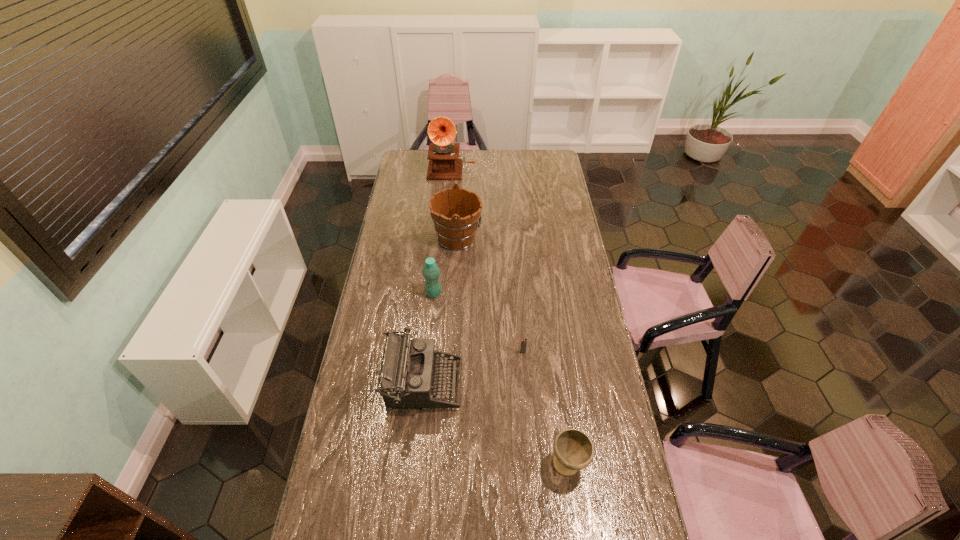
Where is `free region located 0.080m on the horn of the phonograph record`? This screenshot has height=540, width=960. free region located 0.080m on the horn of the phonograph record is located at coordinates (450, 188).

Locate an element on the screen. The image size is (960, 540). vacant space situated with the handle on the wine bucket is located at coordinates (503, 239).

This screenshot has width=960, height=540. I want to click on free spot located at the front cap of the water bottle, so click(466, 293).

Locate an element on the screen. The width and height of the screenshot is (960, 540). vacant region located on the typing side of the typewriter is located at coordinates (551, 384).

Locate an element on the screen. The width and height of the screenshot is (960, 540). vacant space located 0.150m on the back of the second shortest object is located at coordinates (560, 403).

Locate an element on the screen. free space located on the back of the fifth object from left to right is located at coordinates (517, 287).

Identify the location of object that is at the far edge. (x=444, y=163).

The height and width of the screenshot is (540, 960). I want to click on object that is positioned at the left edge, so click(406, 381).

Find the location of `object situated at the right edge`. object situated at the right edge is located at coordinates (574, 450).

The image size is (960, 540). I want to click on vacant space at the far edge of the desktop, so click(471, 156).